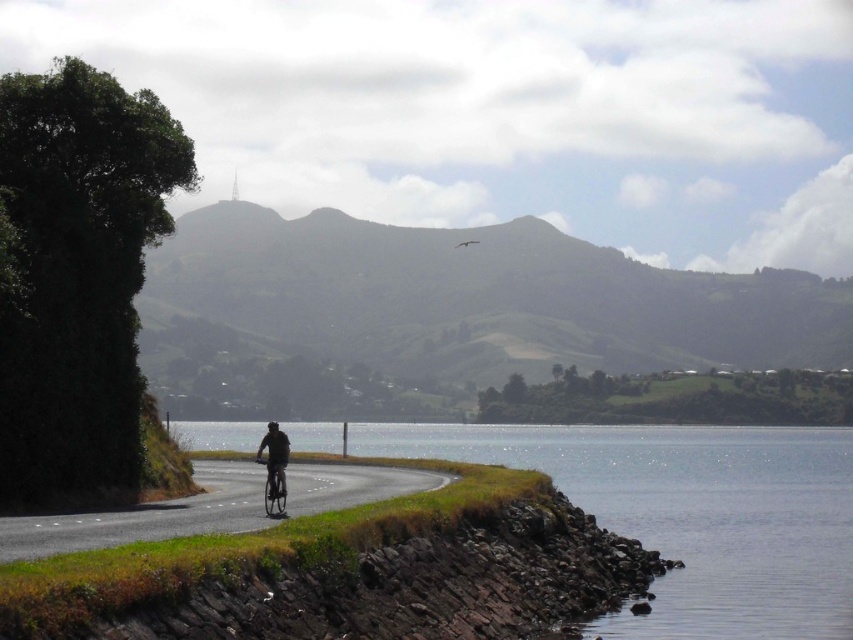
Question: Is black asphalt road at center in front of metallic silver bicycle at center?

Choices:
 (A) no
 (B) yes

Answer: (B)

Question: Which point is closer to the camera taking this photo?

Choices:
 (A) (334, 497)
 (B) (544, 468)
 (C) (274, 497)

Answer: (C)

Question: Is clear water at lower right smaller than metallic silver bicycle at center?

Choices:
 (A) no
 (B) yes

Answer: (A)

Question: Which of these objects is positioned farthest from the black asphalt road at center?

Choices:
 (A) metallic silver bicycle at center
 (B) clear water at lower right

Answer: (B)

Question: Does clear water at lower right have a larger size compared to black asphalt road at center?

Choices:
 (A) no
 (B) yes

Answer: (B)

Question: Based on their relative distances, which object is farther from the black asphalt road at center?

Choices:
 (A) metallic silver bicycle at center
 (B) clear water at lower right

Answer: (B)